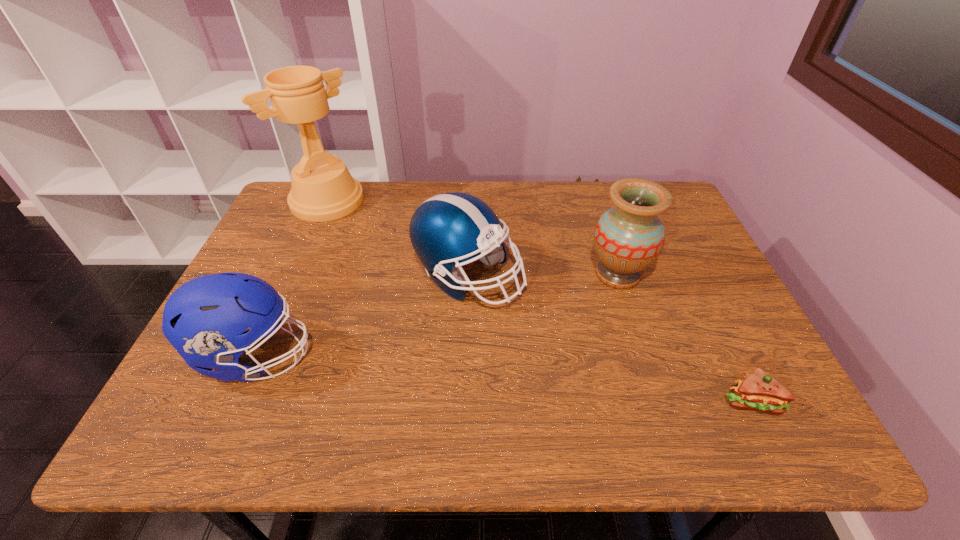
Where is `free space at the far edge of the desktop`? The image size is (960, 540). free space at the far edge of the desktop is located at coordinates (564, 221).

Locate an element on the screen. vacant space at the near edge of the desktop is located at coordinates (443, 417).

The height and width of the screenshot is (540, 960). Identify the location of vacant space at the left edge of the desktop. (290, 303).

Identify the location of free region at the right edge of the desktop. The image size is (960, 540). (720, 282).

Locate an element on the screen. The height and width of the screenshot is (540, 960). free space between the left football helmet and the sandwich is located at coordinates (503, 378).

Where is `empty space between the rightmost object and the vase`? This screenshot has height=540, width=960. empty space between the rightmost object and the vase is located at coordinates (684, 338).

What are the coordinates of `empty location between the right football helmet and the award` in the screenshot? It's located at (397, 238).

The image size is (960, 540). Identify the location of free space between the farthest object and the rightmost object. (540, 301).

Where is `free spot between the left football helmet and the tallest object`? Image resolution: width=960 pixels, height=540 pixels. free spot between the left football helmet and the tallest object is located at coordinates (292, 278).

In order to click on free spot between the left football helmet and the right football helmet in this screenshot , I will do `click(362, 316)`.